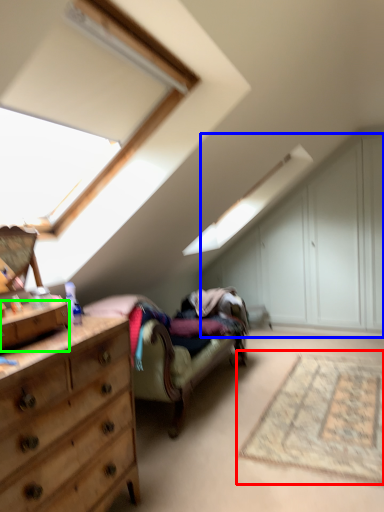
Question: Which object is the closest to the mat (highlighted by a red box)? Choose among these: dresser (highlighted by a blue box) or drawer (highlighted by a green box).

Choices:
 (A) dresser
 (B) drawer

Answer: (B)